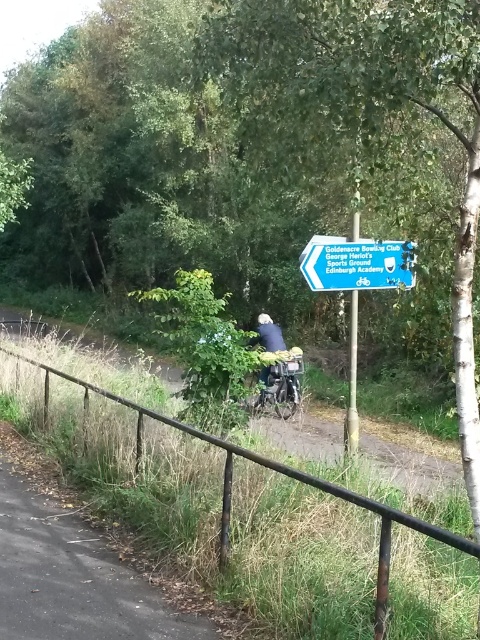
You are a cyclist on the path and want to know the exact location of the green plastic signpost at upper center. What are its coordinates?

The green plastic signpost at upper center is located at coordinates point (357, 262).

You are a photographer trying to capture a photo of the shiny metallic bicycle at center and the metallic pole at center. If you want to ensure both objects are fully visible in your shot, which one should you focus on first to avoid cropping?

The shiny metallic bicycle at center is much taller than the metallic pole at center, so you should focus on the bicycle first to ensure its full height is captured without cropping.

You are a cyclist approaching the shiny metallic bicycle at center and the black metal fence at lower left. Which object is taller?

Answer: The black metal fence at lower left is much taller than the shiny metallic bicycle at center.